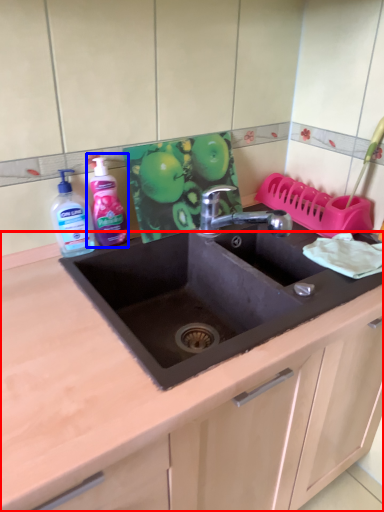
Question: Which object appears farthest to the camera in this image, countertop (highlighted by a red box) or cleaning product (highlighted by a blue box)?

Choices:
 (A) countertop
 (B) cleaning product

Answer: (B)